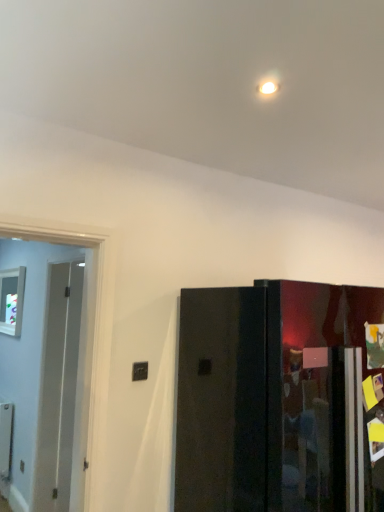
Question: Does white glossy door at left, the first door in the left-to-right sequence, have a larger size compared to transparent glass window at left?

Choices:
 (A) no
 (B) yes

Answer: (B)

Question: Is white glossy door at left, the first door in the left-to-right sequence, to the right of transparent glass window at left from the viewer's perspective?

Choices:
 (A) no
 (B) yes

Answer: (B)

Question: From a real-world perspective, does white glossy door at left, the first door in the left-to-right sequence, stand above transparent glass window at left?

Choices:
 (A) yes
 (B) no

Answer: (B)

Question: From a real-world perspective, is white glossy door at left, the second door in the right-to-left sequence, physically below transparent glass window at left?

Choices:
 (A) yes
 (B) no

Answer: (A)

Question: Is white glossy door at left, the first door in the left-to-right sequence, further to camera compared to transparent glass window at left?

Choices:
 (A) yes
 (B) no

Answer: (B)

Question: Do you think transparent glass window at left is within white glossy door at left, the second door in the right-to-left sequence, or outside of it?

Choices:
 (A) outside
 (B) inside

Answer: (A)

Question: Considering the positions of transparent glass window at left and white glossy door at left, the first door in the left-to-right sequence, in the image, is transparent glass window at left bigger or smaller than white glossy door at left, the first door in the left-to-right sequence,?

Choices:
 (A) small
 (B) big

Answer: (A)

Question: Does point (14, 331) appear closer or farther from the camera than point (8, 345)?

Choices:
 (A) farther
 (B) closer

Answer: (B)

Question: From the image's perspective, is transparent glass window at left above or below white glossy door at left, the second door in the right-to-left sequence?

Choices:
 (A) below
 (B) above

Answer: (B)

Question: Does point (23, 300) appear closer or farther from the camera than point (178, 359)?

Choices:
 (A) farther
 (B) closer

Answer: (A)

Question: Which is correct: transparent glass window at left is inside glossy black refrigerator at right, the 2th door in the left-to-right sequence, or outside of it?

Choices:
 (A) outside
 (B) inside

Answer: (A)

Question: Is transparent glass window at left in front of or behind glossy black refrigerator at right, the 2th door in the left-to-right sequence, in the image?

Choices:
 (A) behind
 (B) front

Answer: (A)

Question: Considering the positions of transparent glass window at left and glossy black refrigerator at right, the 2th door in the left-to-right sequence, in the image, is transparent glass window at left wider or thinner than glossy black refrigerator at right, the 2th door in the left-to-right sequence,?

Choices:
 (A) thin
 (B) wide

Answer: (A)

Question: Is glossy black refrigerator at right, which is the 1th door from right to left, spatially inside transparent glass window at left, or outside of it?

Choices:
 (A) inside
 (B) outside

Answer: (B)

Question: Is glossy black refrigerator at right, the 2th door in the left-to-right sequence, to the left or to the right of transparent glass window at left in the image?

Choices:
 (A) right
 (B) left

Answer: (A)